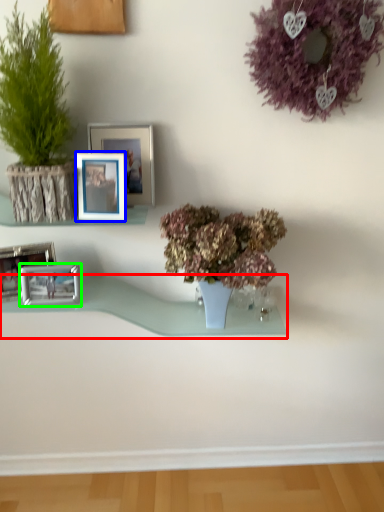
Question: Based on their relative distances, which object is farther from window sill (highlighted by a red box)? Choose from picture frame (highlighted by a blue box) and picture frame (highlighted by a green box).

Choices:
 (A) picture frame
 (B) picture frame

Answer: (A)